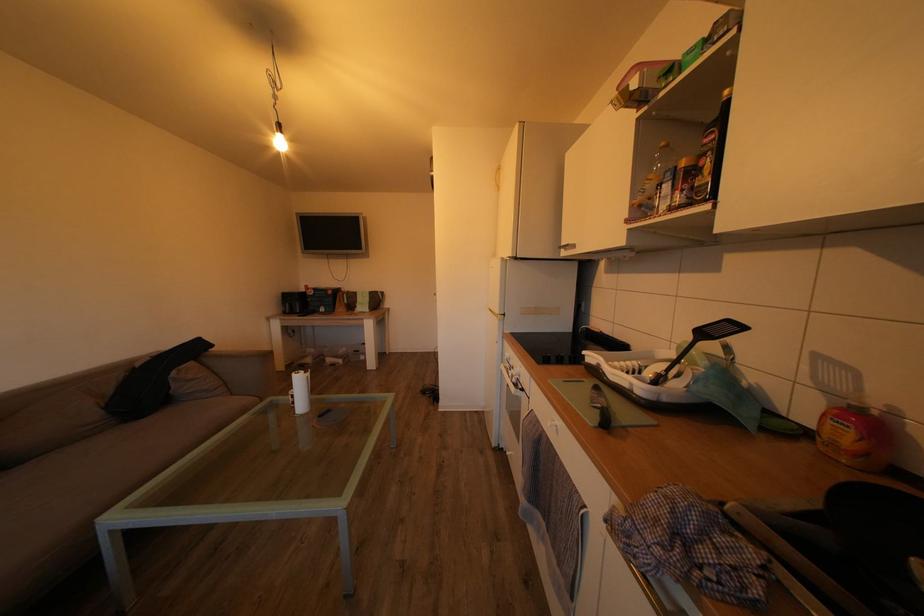
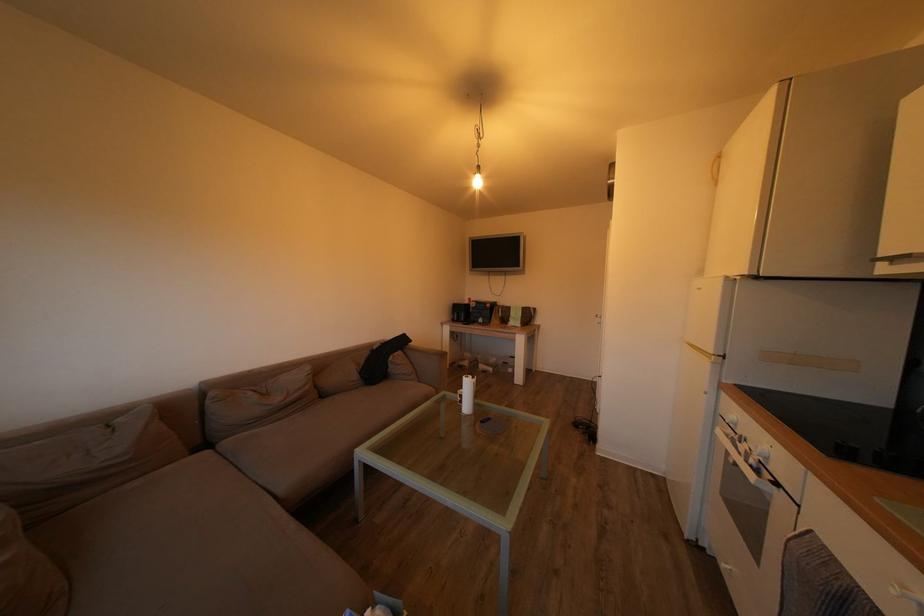
In the second image, find the point that corresponds to [300,402] in the first image.

(468, 402)